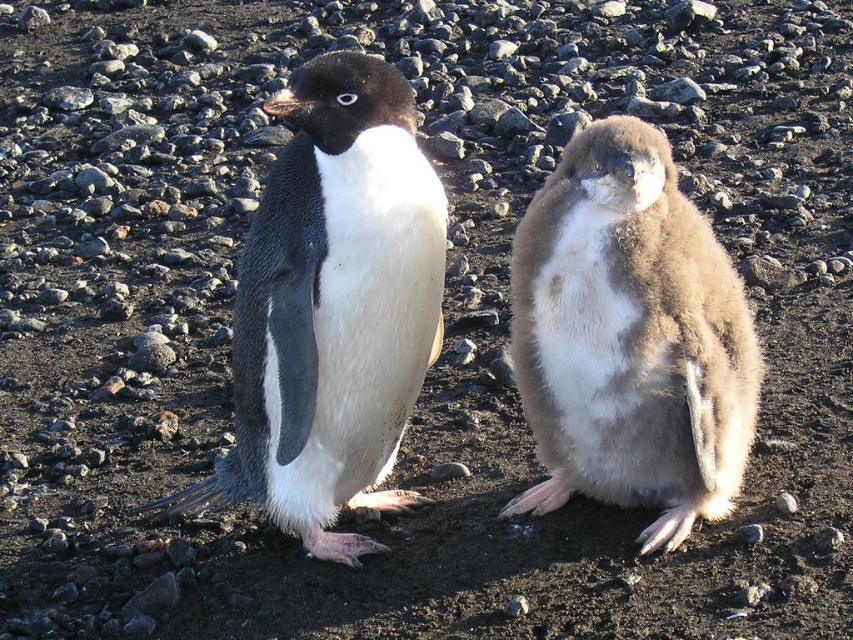
Question: Is matte black penguin at left positioned before brown fluffy penguin at right?

Choices:
 (A) no
 (B) yes

Answer: (B)

Question: Which of the following is the closest to the observer?

Choices:
 (A) (302, 230)
 (B) (561, 273)

Answer: (A)

Question: Is matte black penguin at left thinner than brown fluffy penguin at right?

Choices:
 (A) yes
 (B) no

Answer: (B)

Question: In this image, where is matte black penguin at left located relative to brown fluffy penguin at right?

Choices:
 (A) right
 (B) left

Answer: (B)